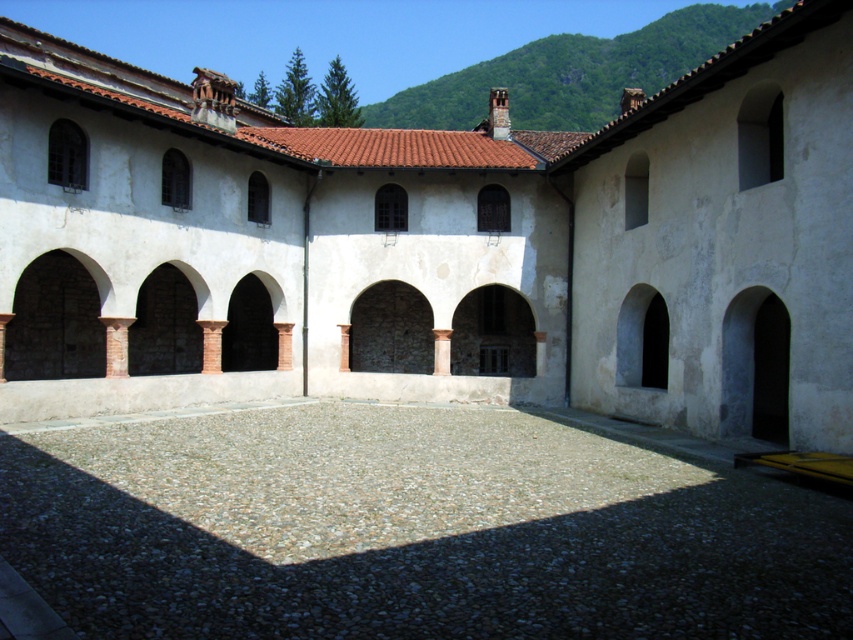
Question: Which object is the closest to the white stone courtyard at center?

Choices:
 (A) dark brown stone archway at center
 (B) dark gray stone archway at lower right
 (C) brown stone archway at center
 (D) gray gravel at center

Answer: (C)

Question: Does dark gray stone archway at lower right appear on the right side of dark stone archway at center?

Choices:
 (A) no
 (B) yes

Answer: (B)

Question: Which point appears closest to the camera in this image?

Choices:
 (A) (99, 141)
 (B) (229, 308)

Answer: (A)

Question: Is dark gray stone archway at lower right smaller than dark brown stone archway at center?

Choices:
 (A) yes
 (B) no

Answer: (B)

Question: Is white stone courtyard at center closer to the viewer compared to dark stone archway at center?

Choices:
 (A) yes
 (B) no

Answer: (A)

Question: Among these points, which one is farthest from the camera?

Choices:
 (A) (581, 531)
 (B) (229, 355)
 (C) (527, 333)

Answer: (B)